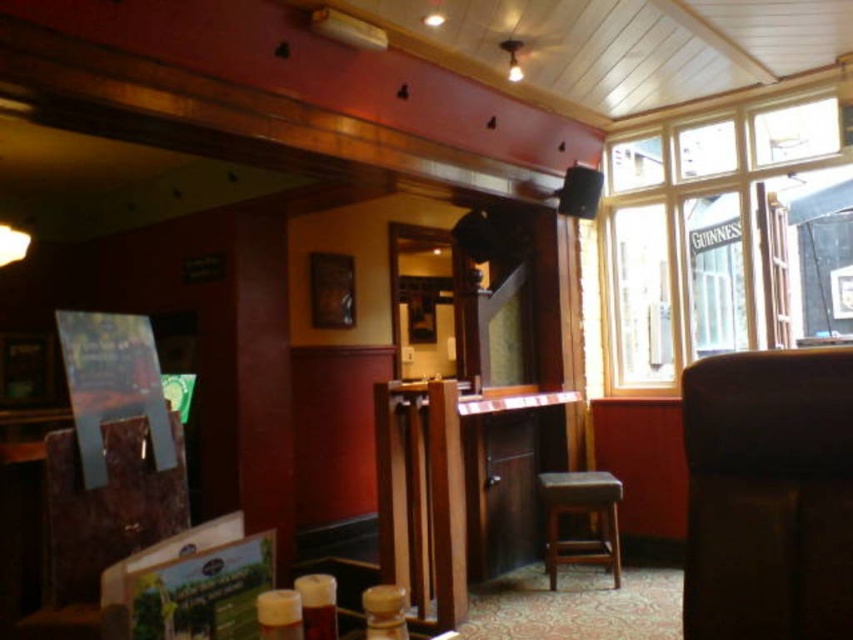
Is clear glass window at upper right behind black leather chair at right?

Yes, clear glass window at upper right is further from the viewer.

Does clear glass window at upper right appear over black leather chair at right?

Indeed, clear glass window at upper right is positioned over black leather chair at right.

From the picture: Who is more forward, (625, 317) or (699, 374)?

Positioned in front is point (699, 374).

Where is `clear glass window at upper right`? The height and width of the screenshot is (640, 853). clear glass window at upper right is located at coordinates (705, 234).

Can you confirm if black leather chair at right is shorter than dark brown leather stool at center?

No.

Does point (848, 428) lie in front of point (601, 493)?

Yes.

Where is `black leather chair at right`? black leather chair at right is located at coordinates (769, 496).

Does point (659, 179) come in front of point (548, 554)?

That is False.

Which is behind, point (625, 250) or point (612, 481)?

The point (625, 250) is behind.

Identify the location of clear glass window at upper right. This screenshot has height=640, width=853. (705, 234).